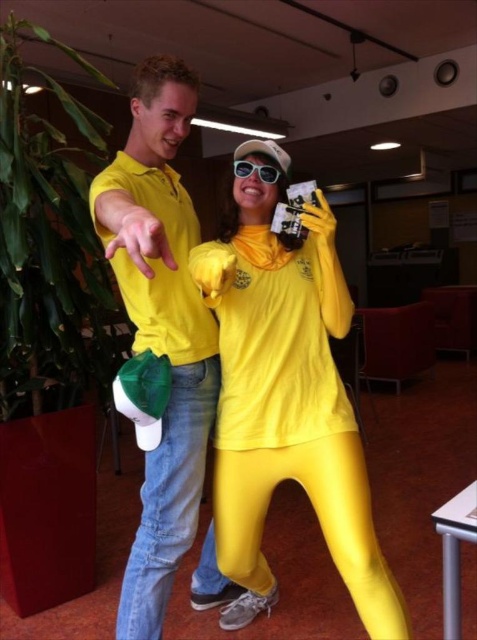
You are designing a storage box that needs to fit both the matte yellow jumpsuit at center and the sunglasses at center. Based on their sizes, which item should be placed in the larger compartment?

The matte yellow jumpsuit at center requires the larger compartment because its width is greater than that of the sunglasses at center.

You are standing in the same room as the two people in the image. You want to move from the matte yellow shirt at left to the matte yellow jumpsuit at center. Which direction should you move?

You should move to the right to reach the matte yellow jumpsuit at center from the matte yellow shirt at left since it is positioned to the right of it.